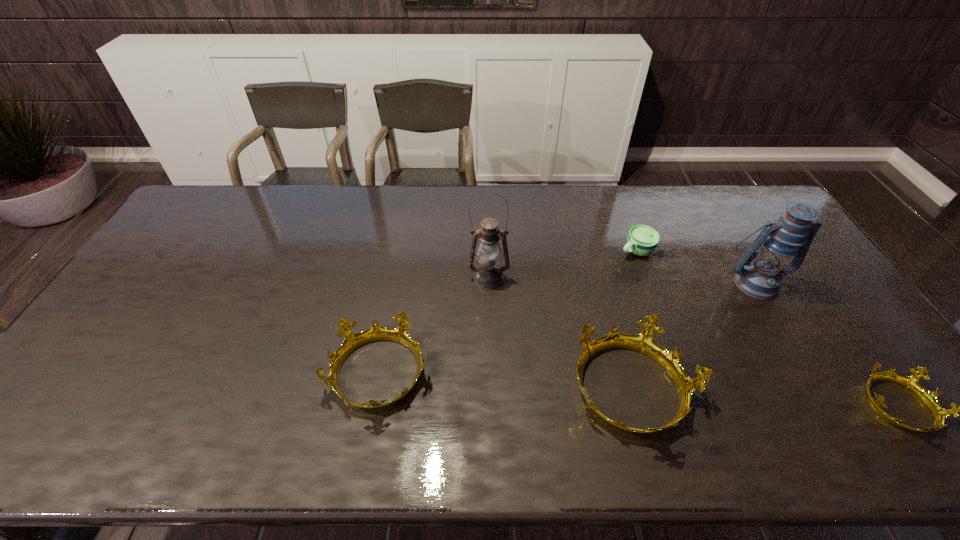
The height and width of the screenshot is (540, 960). Find the location of `free point that keeps the crowns evenly spaced on the left`. free point that keeps the crowns evenly spaced on the left is located at coordinates (142, 359).